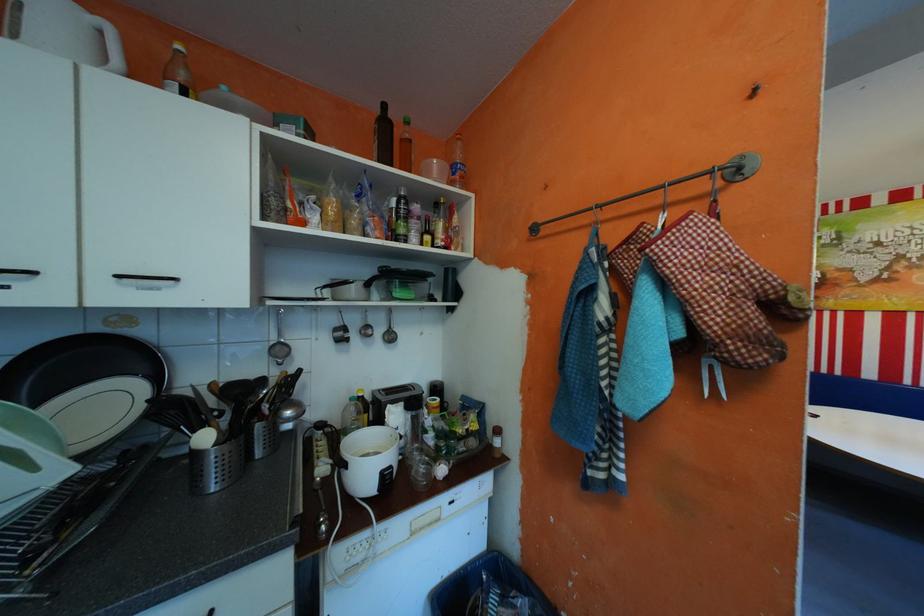
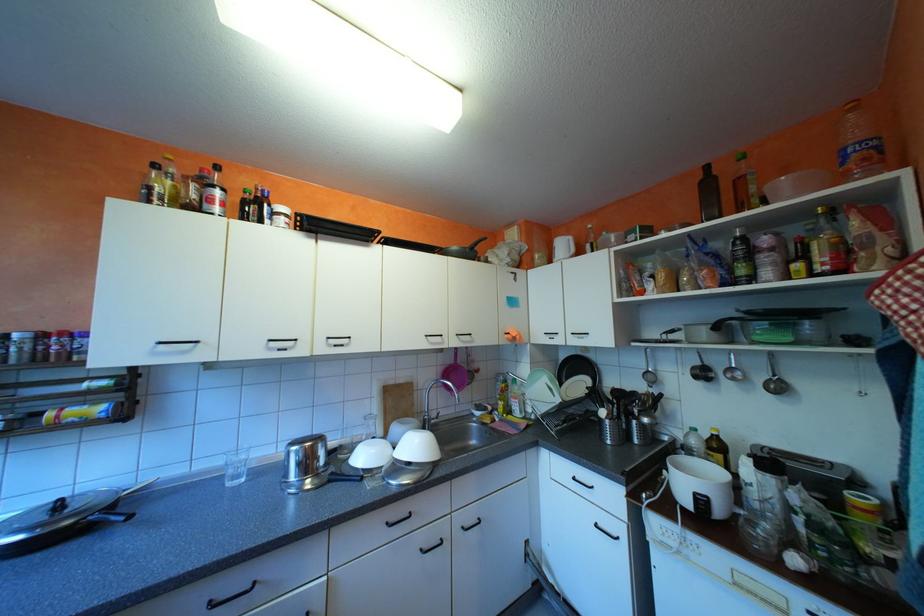
Where in the second image is the point corresponding to point (391, 331) from the first image?

(772, 377)